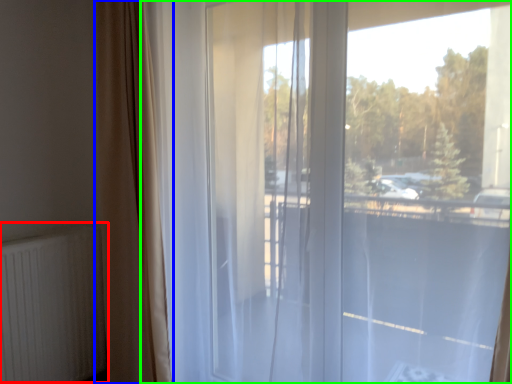
Question: Estimate the real-world distances between objects in this image. Which object is closer to radiator (highlighted by a red box), curtain (highlighted by a blue box) or window (highlighted by a green box)?

Choices:
 (A) curtain
 (B) window

Answer: (A)